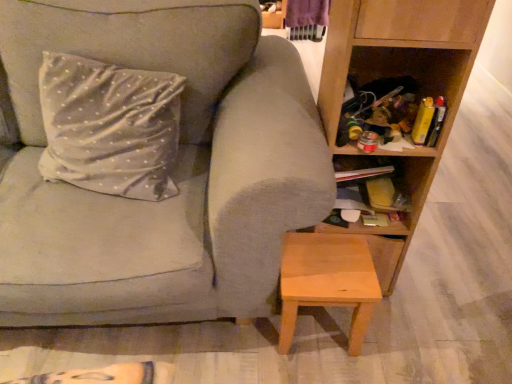
Measure the distance between wooden cabinet at lower right and camera.

wooden cabinet at lower right is 3.82 feet from camera.

Where is `wooden shelf at right`? wooden shelf at right is located at coordinates (402, 73).

Where is `wooden cabinet at lower right`? wooden cabinet at lower right is located at coordinates (412, 199).

Does light brown wooden stool at lower center appear on the left side of matte gray couch at center?

In fact, light brown wooden stool at lower center is to the right of matte gray couch at center.

Is light brown wooden stool at lower center thinner than matte gray couch at center?

Indeed, light brown wooden stool at lower center has a lesser width compared to matte gray couch at center.

From their relative heights in the image, would you say light brown wooden stool at lower center is taller or shorter than matte gray couch at center?

Considering their sizes, light brown wooden stool at lower center has less height than matte gray couch at center.

Is light brown wooden stool at lower center beside matte gray couch at center?

No, light brown wooden stool at lower center is not touching matte gray couch at center.

Is matte gray couch at center aimed at light brown wooden stool at lower center?

No, matte gray couch at center is not turned towards light brown wooden stool at lower center.

From a real-world perspective, is matte gray couch at center over light brown wooden stool at lower center?

Yes, from a real-world perspective, matte gray couch at center is above light brown wooden stool at lower center.

Who is more distant, matte gray couch at center or light brown wooden stool at lower center?

light brown wooden stool at lower center.

Does light brown wooden stool at lower center touch wooden cabinet at lower right?

No, light brown wooden stool at lower center is not next to wooden cabinet at lower right.

The width and height of the screenshot is (512, 384). There is a light brown wooden stool at lower center. Identify the location of cabinet above it (from a real-world perspective). (412, 199).

Who is shorter, light brown wooden stool at lower center or wooden cabinet at lower right?

With less height is wooden cabinet at lower right.

Which of these two, light brown wooden stool at lower center or wooden cabinet at lower right, is wider?

light brown wooden stool at lower center.

From a real-world perspective, is wooden cabinet at lower right under light brown wooden stool at lower center?

No, from a real-world perspective, wooden cabinet at lower right is not below light brown wooden stool at lower center.

Is wooden cabinet at lower right taller than light brown wooden stool at lower center?

In fact, wooden cabinet at lower right may be shorter than light brown wooden stool at lower center.

Based on the photo, is wooden cabinet at lower right situated inside light brown wooden stool at lower center or outside?

wooden cabinet at lower right is outside light brown wooden stool at lower center.

Looking at their sizes, would you say matte gray couch at center is wider or thinner than wooden shelf at right?

In the image, matte gray couch at center appears to be wider than wooden shelf at right.

Between matte gray couch at center and wooden shelf at right, which one has smaller size?

wooden shelf at right.

Is point (247, 274) less distant than point (420, 156)?

Yes, point (247, 274) is in front of point (420, 156).

Consider the image. Is wooden cabinet at lower right next to matte gray couch at center?

wooden cabinet at lower right and matte gray couch at center are clearly separated.

Considering the relative sizes of wooden cabinet at lower right and matte gray couch at center in the image provided, is wooden cabinet at lower right shorter than matte gray couch at center?

Indeed, wooden cabinet at lower right has a lesser height compared to matte gray couch at center.

Looking at this image, is wooden cabinet at lower right to the left of matte gray couch at center from the viewer's perspective?

No.

From a real-world perspective, is wooden cabinet at lower right beneath matte gray couch at center?

Yes.

Looking at this image, is the surface of silky silver pillow at upper left in direct contact with wooden cabinet at lower right?

No, silky silver pillow at upper left is not beside wooden cabinet at lower right.

Is silky silver pillow at upper left smaller than wooden cabinet at lower right?

No, silky silver pillow at upper left is not smaller than wooden cabinet at lower right.

In the image, is silky silver pillow at upper left positioned in front of or behind wooden cabinet at lower right?

In the image, silky silver pillow at upper left appears in front of wooden cabinet at lower right.

The width and height of the screenshot is (512, 384). What are the coordinates of `cabinet lying on the right of silky silver pillow at upper left` in the screenshot? It's located at (412, 199).

The width and height of the screenshot is (512, 384). I want to click on chair that appears on the left of light brown wooden stool at lower center, so click(174, 171).

Locate an element on the screen. The height and width of the screenshot is (384, 512). stool directly beneath the matte gray couch at center (from a real-world perspective) is located at coordinates [327, 281].

Considering their positions, is wooden cabinet at lower right positioned closer to wooden shelf at right than light brown wooden stool at lower center?

wooden cabinet at lower right lies closer to wooden shelf at right than the other object.

Looking at the image, which one is located further to wooden cabinet at lower right, wooden shelf at right or matte gray couch at center?

Based on the image, matte gray couch at center appears to be further to wooden cabinet at lower right.

Based on the photo, which object lies nearer to the anchor point silky silver pillow at upper left, light brown wooden stool at lower center or matte gray couch at center?

matte gray couch at center lies closer to silky silver pillow at upper left than the other object.

Which object lies further to the anchor point matte gray couch at center, wooden shelf at right or light brown wooden stool at lower center?

Based on the image, wooden shelf at right appears to be further to matte gray couch at center.

Estimate the real-world distances between objects in this image. Which object is further from wooden shelf at right, wooden cabinet at lower right or matte gray couch at center?

The object further to wooden shelf at right is matte gray couch at center.

Based on their spatial positions, is light brown wooden stool at lower center or silky silver pillow at upper left further from matte gray couch at center?

light brown wooden stool at lower center lies further to matte gray couch at center than the other object.

Estimate the real-world distances between objects in this image. Which object is closer to wooden shelf at right, matte gray couch at center or light brown wooden stool at lower center?

light brown wooden stool at lower center is positioned closer to the anchor wooden shelf at right.

Considering their positions, is wooden shelf at right positioned closer to light brown wooden stool at lower center than silky silver pillow at upper left?

Among the two, wooden shelf at right is located nearer to light brown wooden stool at lower center.

Locate an element on the screen. The width and height of the screenshot is (512, 384). pillow between matte gray couch at center and wooden cabinet at lower right from left to right is located at coordinates (109, 127).

Where is `cabinet located between matte gray couch at center and wooden shelf at right in the left-right direction`? Image resolution: width=512 pixels, height=384 pixels. cabinet located between matte gray couch at center and wooden shelf at right in the left-right direction is located at coordinates (412, 199).

At what (x,y) coordinates should I click in order to perform the action: click on stool situated between matte gray couch at center and wooden shelf at right from left to right. Please return your answer as a coordinate pair (x, y). This screenshot has width=512, height=384. Looking at the image, I should click on (327, 281).

Identify the location of stool between silky silver pillow at upper left and wooden cabinet at lower right from left to right. The image size is (512, 384). (327, 281).